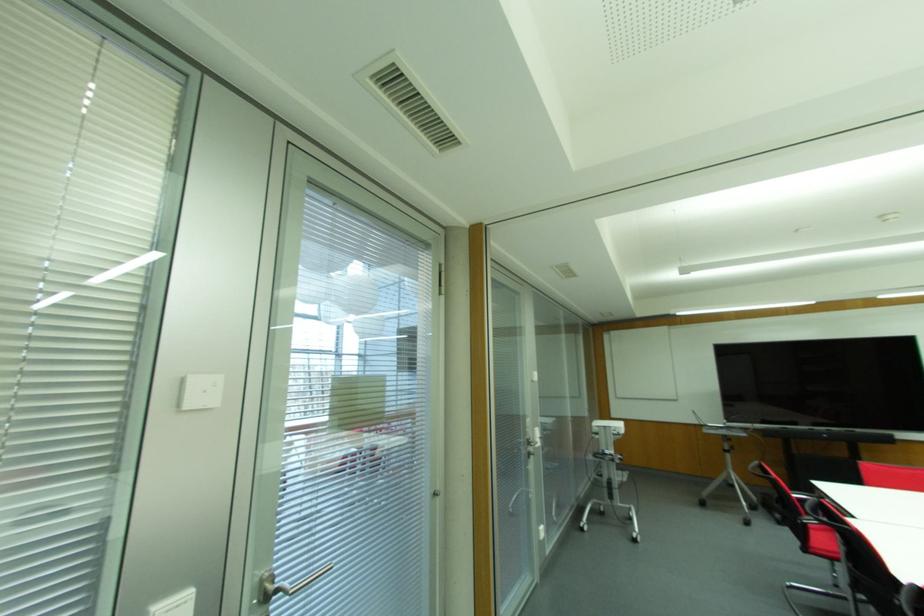
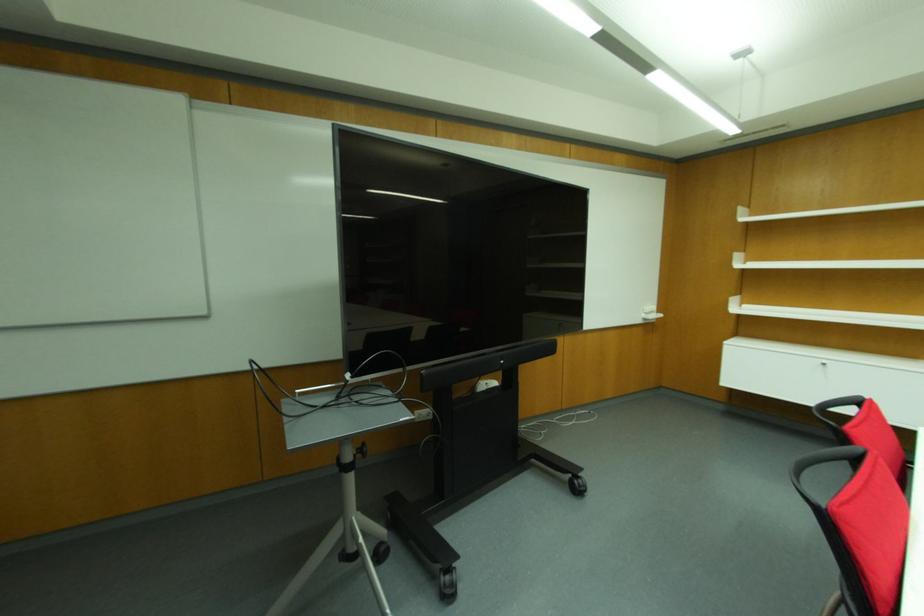
Locate, in the second image, the point that corresponds to (x=781, y=523) in the first image.

(448, 594)